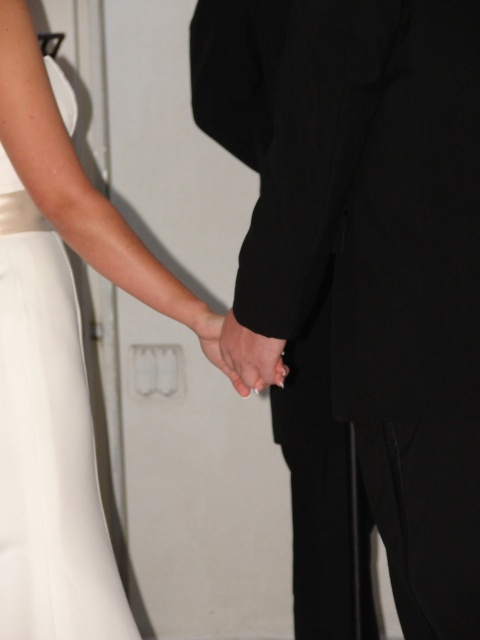
You are a photographer adjusting the lighting for a formal portrait. You notice the black smooth suit at center and the smooth skin hand at center in the frame. Which object should you focus on to ensure proper exposure, considering their size in the image?

The black smooth suit at center is much taller than the smooth skin hand at center, so focusing on the larger black smooth suit at center will ensure proper exposure for the main subject.